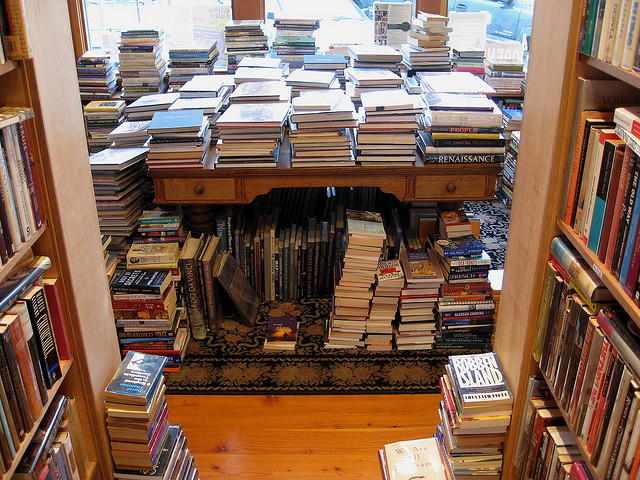
Where is `drawer`? This screenshot has width=640, height=480. drawer is located at coordinates (441, 173).